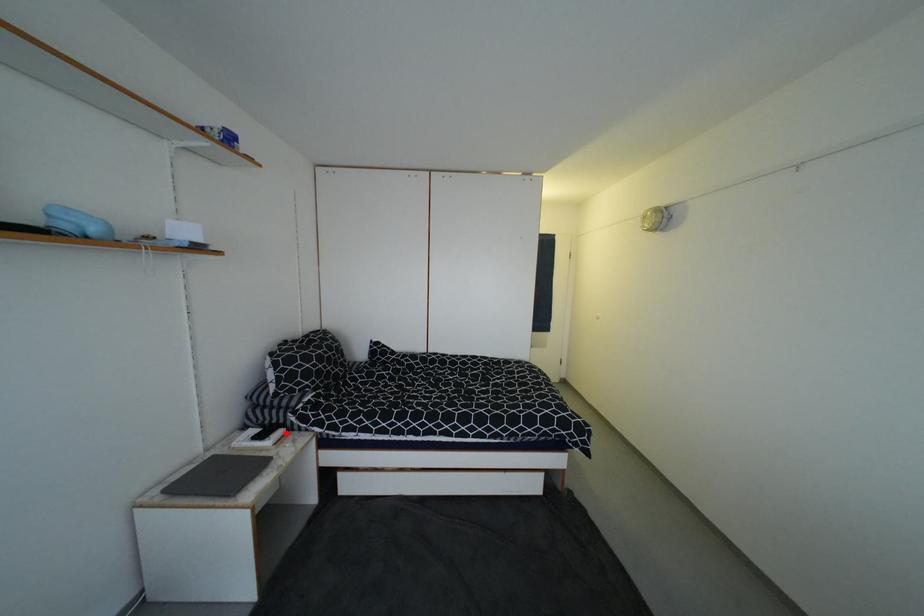
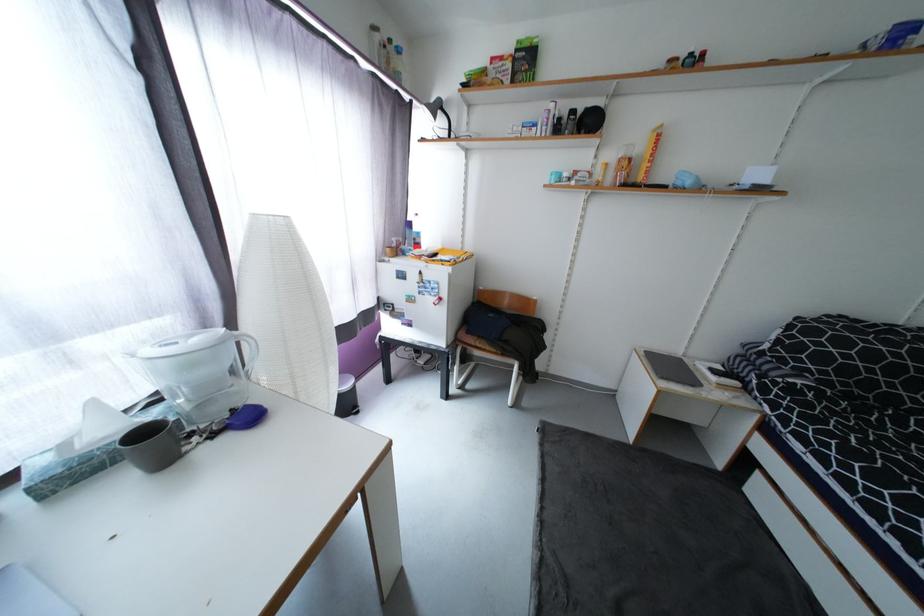
The point at the highlighted location is marked in the first image. Where is the corresponding point in the second image?

(740, 385)